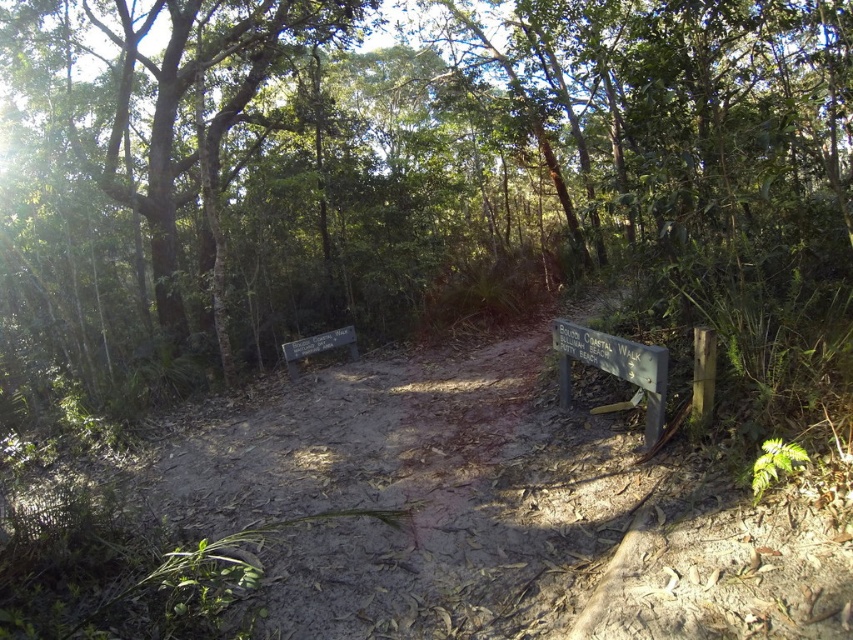
Question: From the image, what is the correct spatial relationship of green leafy tree at center in relation to wooden sign at center-right?

Choices:
 (A) left
 (B) right

Answer: (A)

Question: Which object is closer to the camera taking this photo?

Choices:
 (A) brown dirt track at center
 (B) green leafy tree at center
 (C) wooden sign at center-right

Answer: (A)

Question: Which object is farther from the camera taking this photo?

Choices:
 (A) wooden sign at center-right
 (B) green leafy tree at center
 (C) green leafy tree at left

Answer: (C)

Question: Based on their relative distances, which object is farther from the green leafy tree at center?

Choices:
 (A) wooden sign at center
 (B) brown dirt track at center
 (C) wooden sign at center-right
 (D) green leafy tree at left

Answer: (C)

Question: Does brown dirt track at center appear on the right side of wooden sign at center-right?

Choices:
 (A) yes
 (B) no

Answer: (B)

Question: Where is green leafy tree at center located in relation to wooden sign at center in the image?

Choices:
 (A) left
 (B) right

Answer: (A)